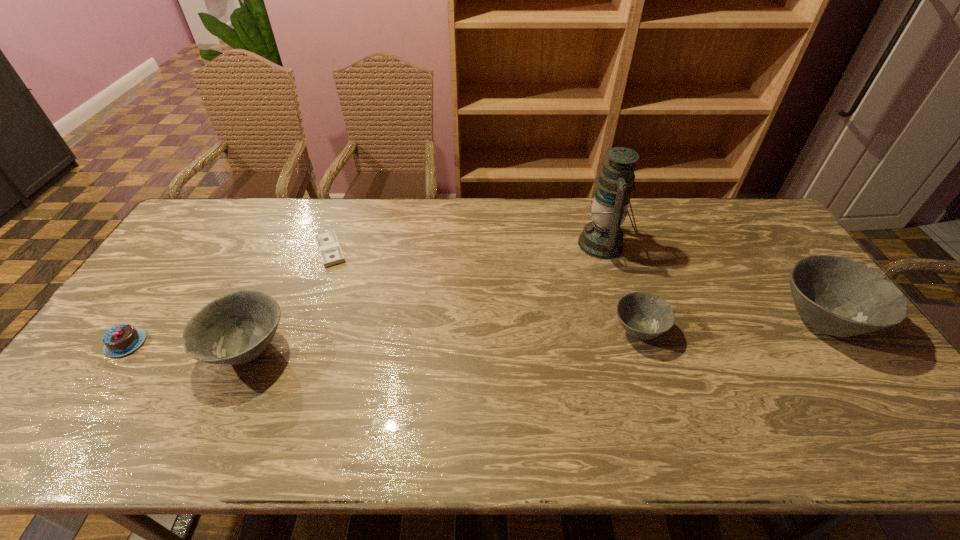
Locate an element on the screen. free spot between the leftmost object and the shortest bowl is located at coordinates [382, 336].

Where is `vacant area that lies between the tallest object and the second shortest bowl`? Image resolution: width=960 pixels, height=540 pixels. vacant area that lies between the tallest object and the second shortest bowl is located at coordinates (425, 297).

Locate an element on the screen. The width and height of the screenshot is (960, 540). vacant area that lies between the second bowl from left to right and the rightmost object is located at coordinates (731, 325).

Identify which object is located as the third nearest to the shortest bowl. Please provide its 2D coordinates. Your answer should be formatted as a tuple, i.e. [(x, y)], where the tuple contains the x and y coordinates of a point satisfying the conditions above.

[(331, 253)]

Locate which object is the third closest to the rightmost object. Please provide its 2D coordinates. Your answer should be formatted as a tuple, i.e. [(x, y)], where the tuple contains the x and y coordinates of a point satisfying the conditions above.

[(331, 253)]

Identify which bowl is located as the nearest to the rightmost bowl. Please provide its 2D coordinates. Your answer should be formatted as a tuple, i.e. [(x, y)], where the tuple contains the x and y coordinates of a point satisfying the conditions above.

[(643, 315)]

Where is `bowl that stands as the second closest to the second shortest bowl`? The width and height of the screenshot is (960, 540). bowl that stands as the second closest to the second shortest bowl is located at coordinates pyautogui.click(x=840, y=297).

Identify the location of free location that satisfies the following two spatial constraints: 1. on the front side of the leftmost object; 2. on the right side of the leftmost bowl. (121, 350).

I want to click on blank space that satisfies the following two spatial constraints: 1. on the back side of the shortest object; 2. on the right side of the leftmost bowl, so click(294, 251).

Find the location of a particular element. free region that satisfies the following two spatial constraints: 1. on the back side of the dollar; 2. on the right side of the tallest object is located at coordinates (332, 244).